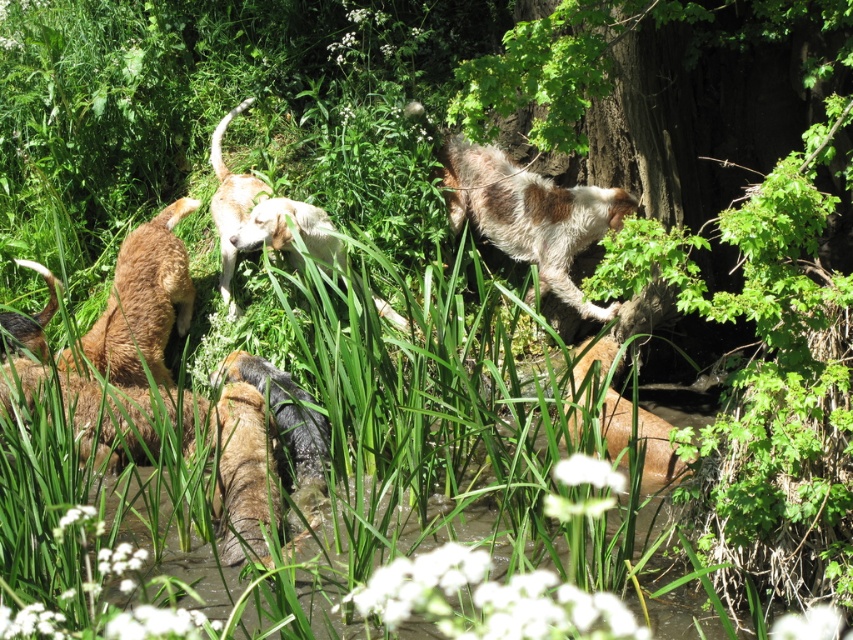
Question: Where is brown fur dog at upper center located in relation to brown furry dog at lower right in the image?

Choices:
 (A) below
 (B) above

Answer: (B)

Question: Which point is closer to the camera taking this photo?

Choices:
 (A) (329, 227)
 (B) (495, 186)

Answer: (A)

Question: Which object is farther from the camera taking this photo?

Choices:
 (A) brown fur dog at upper center
 (B) brown furry dog at lower right
 (C) brown fur dog at center

Answer: (A)

Question: Does brown furry dog at lower right have a smaller size compared to white fur dog at center?

Choices:
 (A) no
 (B) yes

Answer: (A)

Question: Which point is farther to the camera?

Choices:
 (A) (325, 212)
 (B) (556, 294)
 (C) (228, 410)

Answer: (B)

Question: Does brown fur dog at center have a smaller size compared to brown fur dog at upper center?

Choices:
 (A) yes
 (B) no

Answer: (B)